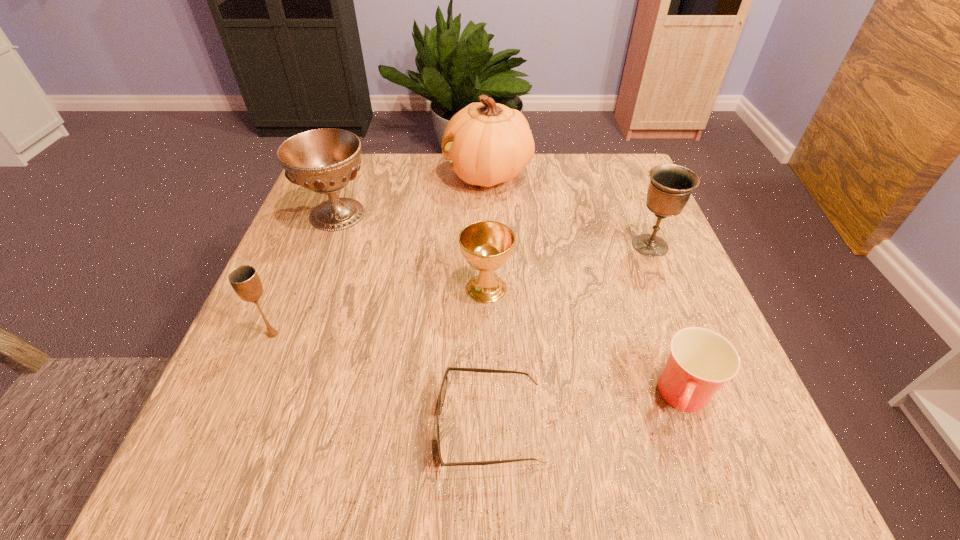
This screenshot has width=960, height=540. Find the location of `chalice that can be found as the third closest to the shortest chalice`. chalice that can be found as the third closest to the shortest chalice is located at coordinates (245, 281).

The height and width of the screenshot is (540, 960). Find the location of `free space in the image that satisfies the following two spatial constraints: 1. on the front face of the pumpkin; 2. on the left side of the rightmost chalice`. free space in the image that satisfies the following two spatial constraints: 1. on the front face of the pumpkin; 2. on the left side of the rightmost chalice is located at coordinates (490, 246).

The height and width of the screenshot is (540, 960). What are the coordinates of `vacant space that satisfies the following two spatial constraints: 1. on the front side of the cup; 2. on the right side of the third nearest object` in the screenshot? It's located at pyautogui.click(x=247, y=397).

This screenshot has height=540, width=960. I want to click on vacant space that satisfies the following two spatial constraints: 1. on the front face of the tallest object; 2. on the front side of the fifth farthest object, so click(492, 334).